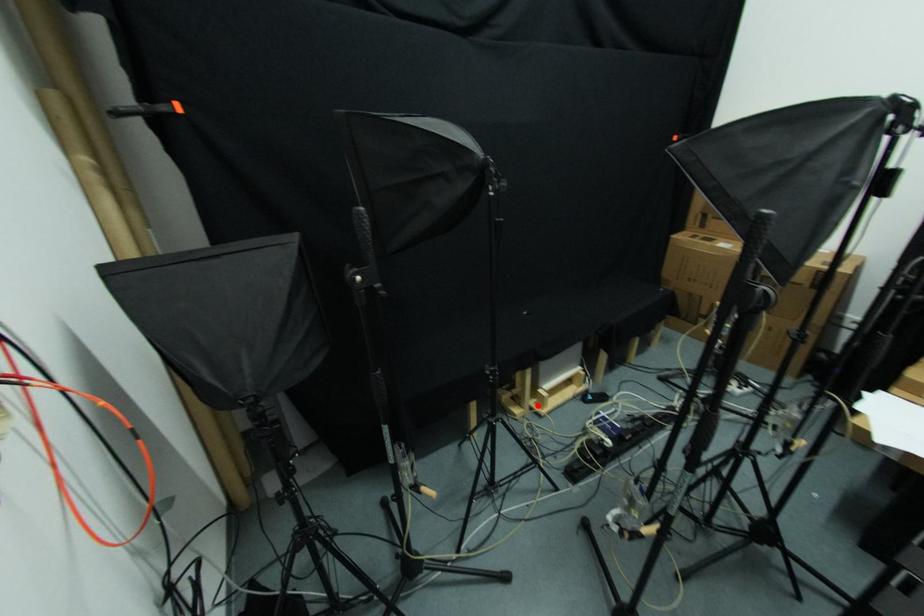
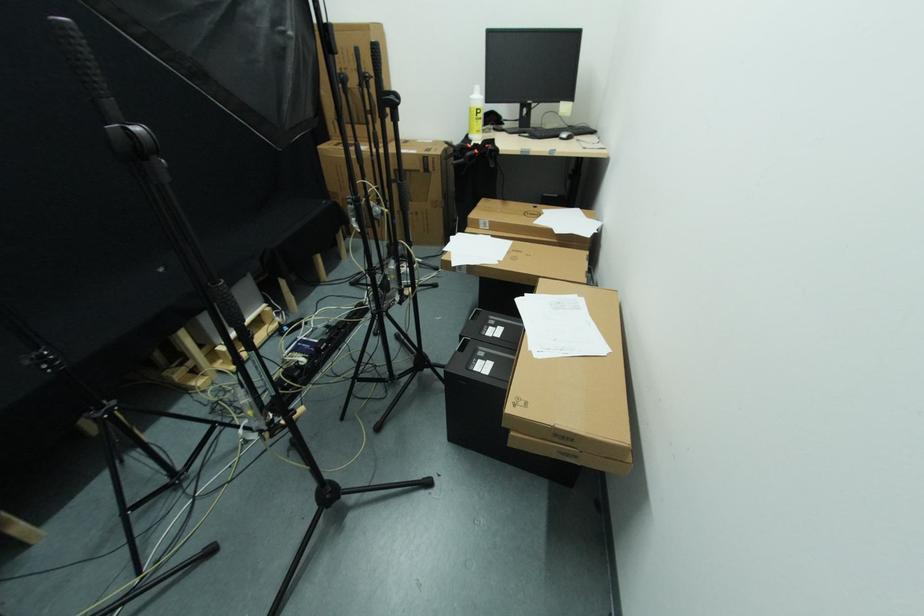
Locate, in the second image, the point that corresponds to the highlighted location in the first image.

(225, 365)